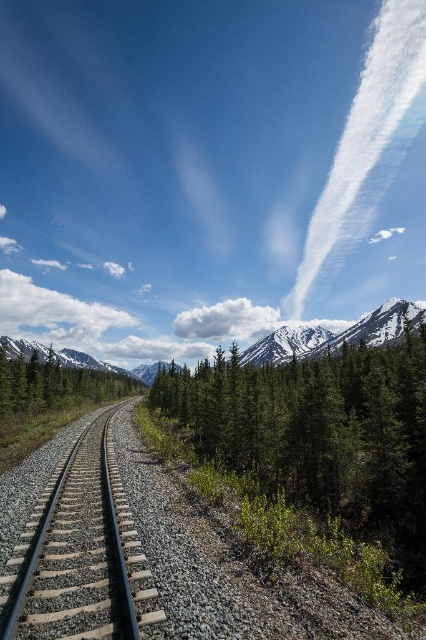
Question: Among these points, which one is farthest from the camera?

Choices:
 (A) [28, 380]
 (B) [290, 349]
 (C) [11, 572]
 (D) [400, 316]

Answer: (B)

Question: Can you confirm if green matte tree at center is bigger than green matte tree at left?

Choices:
 (A) no
 (B) yes

Answer: (A)

Question: Can you confirm if green matte tree at center is positioned below snowy granite mountain at upper center?

Choices:
 (A) yes
 (B) no

Answer: (A)

Question: Does smooth steel tracks at center have a greater width compared to snowy granite mountain at upper center?

Choices:
 (A) yes
 (B) no

Answer: (B)

Question: Which point is closer to the camera?

Choices:
 (A) green matte tree at left
 (B) green matte tree at center
 (C) smooth steel tracks at center
 (D) snowy granite mountain at upper center

Answer: (C)

Question: Among these points, which one is farthest from the camera?

Choices:
 (A) (397, 380)
 (B) (94, 394)

Answer: (B)